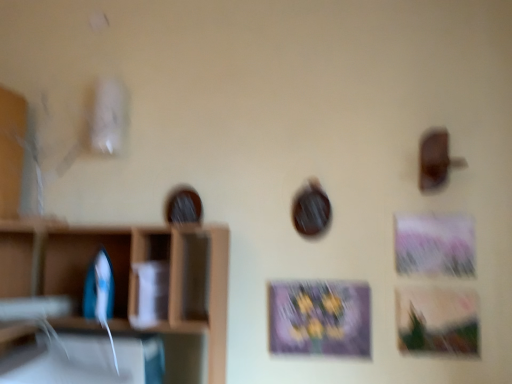
Locate an element on the screen. blue plastic iron at left is located at coordinates (86, 262).

Identify the location of matte purple picture frame at center. (319, 318).

Identify the location of blue plastic iron at left. The height and width of the screenshot is (384, 512). (86, 262).

Considering the positions of point (131, 253) and point (289, 325), is point (131, 253) closer or farther from the camera than point (289, 325)?

Point (131, 253) is closer to the camera than point (289, 325).

Is wooden shelf at left positioned beyond the bounds of matte purple picture frame at center?

wooden shelf at left is positioned outside matte purple picture frame at center.

Is wooden shelf at left oriented towards matte purple picture frame at center?

No, wooden shelf at left is not turned towards matte purple picture frame at center.

Which object is positioned more to the left, wooden shelf at left or matte purple picture frame at center?

From the viewer's perspective, wooden shelf at left appears more on the left side.

Is wooden shelf at left looking in the opposite direction of blue plastic iron at left?

Correct, wooden shelf at left is looking away from blue plastic iron at left.

From the picture: In terms of height, does wooden shelf at left look taller or shorter compared to blue plastic iron at left?

Considering their sizes, wooden shelf at left has more height than blue plastic iron at left.

Based on the photo, is the surface of wooden shelf at left in direct contact with blue plastic iron at left?

No.

Which object is thinner, matte purple picture frame at center or blue plastic iron at left?

matte purple picture frame at center.

What's the angular difference between matte purple picture frame at center and blue plastic iron at left's facing directions?

The angular difference between matte purple picture frame at center and blue plastic iron at left is 0.58 degrees.

Are matte purple picture frame at center and blue plastic iron at left located far from each other?

No, matte purple picture frame at center is in close proximity to blue plastic iron at left.

Between matte purple picture frame at center and blue plastic iron at left, which one is positioned in front?

blue plastic iron at left is more forward.

Is blue plastic iron at left at the right side of matte purple picture frame at center?

No.

In the image, there is a blue plastic iron at left. At what (x,y) coordinates should I click in order to perform the action: click on picture frame below it (from a real-world perspective). Please return your answer as a coordinate pair (x, y). The image size is (512, 384). Looking at the image, I should click on (319, 318).

Which object is more forward, blue plastic iron at left or matte purple picture frame at center?

blue plastic iron at left is in front.

What's the angular difference between blue plastic iron at left and matte purple picture frame at center's facing directions?

The angle between the facing direction of blue plastic iron at left and the facing direction of matte purple picture frame at center is 0.58 degrees.

Could wooden shelf at left be considered to be inside matte purple picture frame at center?

No, wooden shelf at left is not inside matte purple picture frame at center.

From a real-world perspective, between matte purple picture frame at center and wooden shelf at left, who is vertically higher?

In real-world perspective, wooden shelf at left is above.

Which is in front, point (269, 308) or point (54, 285)?

The point (269, 308) is closer to the camera.

Can you confirm if matte purple picture frame at center is shorter than wooden shelf at left?

Yes.

How different are the orientations of blue plastic iron at left and wooden shelf at left in degrees?

blue plastic iron at left and wooden shelf at left are facing 0.294 degrees away from each other.

Considering the positions of points (115, 300) and (110, 96), is point (115, 300) closer to camera compared to point (110, 96)?

Yes, it is in front of point (110, 96).

Could you tell me if blue plastic iron at left is facing wooden shelf at left?

Yes, blue plastic iron at left is aimed at wooden shelf at left.

Is blue plastic iron at left next to wooden shelf at left?

blue plastic iron at left is not next to wooden shelf at left, and they're not touching.

Locate an element on the screen. shelf above the matte purple picture frame at center (from the image's perspective) is located at coordinates (115, 260).

Locate an element on the screen. This screenshot has height=384, width=512. shelf on the left of blue plastic iron at left is located at coordinates (115, 260).

Considering their positions, is wooden shelf at left positioned closer to blue plastic iron at left than matte purple picture frame at center?

wooden shelf at left is positioned closer to the anchor blue plastic iron at left.

Based on their spatial positions, is wooden shelf at left or blue plastic iron at left closer to matte purple picture frame at center?

wooden shelf at left lies closer to matte purple picture frame at center than the other object.

Considering their positions, is blue plastic iron at left positioned further to wooden shelf at left than matte purple picture frame at center?

matte purple picture frame at center is further to wooden shelf at left.

When comparing their distances from blue plastic iron at left, does matte purple picture frame at center or wooden shelf at left seem further?

Among the two, matte purple picture frame at center is located further to blue plastic iron at left.

Estimate the real-world distances between objects in this image. Which object is closer to matte purple picture frame at center, blue plastic iron at left or wooden shelf at left?

Based on the image, wooden shelf at left appears to be nearer to matte purple picture frame at center.

Estimate the real-world distances between objects in this image. Which object is further from wooden shelf at left, matte purple picture frame at center or blue plastic iron at left?

matte purple picture frame at center.

The height and width of the screenshot is (384, 512). I want to click on cabinet between wooden shelf at left and matte purple picture frame at center in the horizontal direction, so click(86, 262).